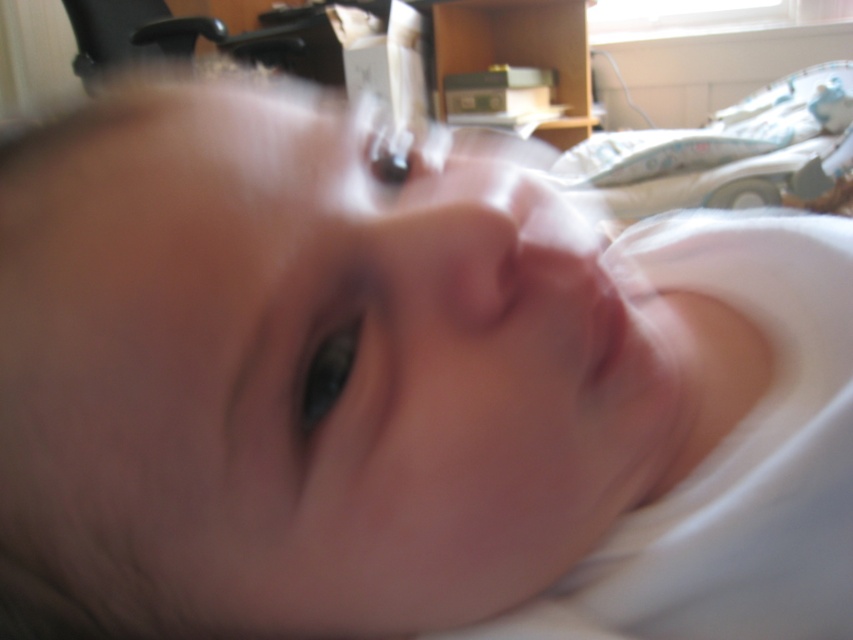
You are a nurse checking on a newborn in the nursery. You see the white fabric hospital bed at upper right and the smooth flesh mouth at center. Which object is closer to you?

The white fabric hospital bed at upper right is closer to you than the smooth flesh mouth at center.

You are a nurse checking the baby in the nursery. You notice a point at coordinates (x=711, y=150) on the baby. Where is this point located relative to the white fabric hospital bed at upper right?

The point at coordinates (x=711, y=150) is located on the white fabric hospital bed at upper right.

You are a nurse checking on a baby in a hospital room. You notice the white fabric hospital bed at upper right and the smooth flesh mouth at center. How far apart are these two items?

The white fabric hospital bed at upper right is 4.63 feet away from the smooth flesh mouth at center.